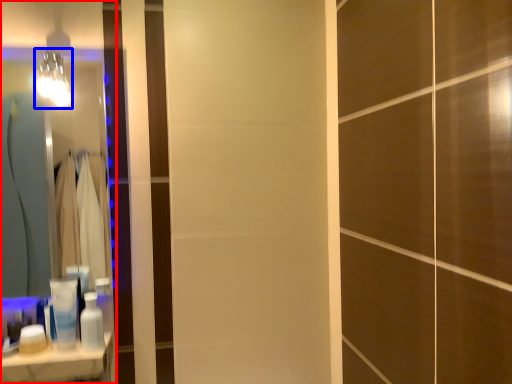
Question: Which point is closer to the camera, mirror (highlighted by a red box) or light fixture (highlighted by a blue box)?

Choices:
 (A) mirror
 (B) light fixture

Answer: (B)